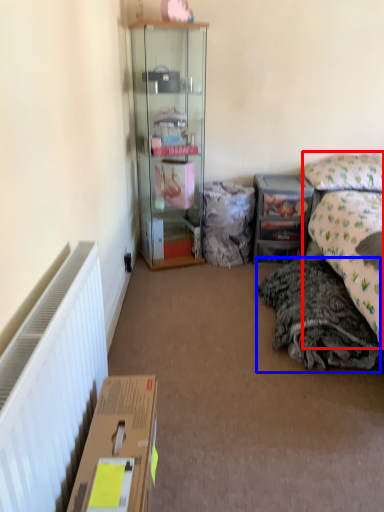
Question: Which object appears farthest to the camera in this image, bed (highlighted by a red box) or material (highlighted by a blue box)?

Choices:
 (A) bed
 (B) material

Answer: (B)